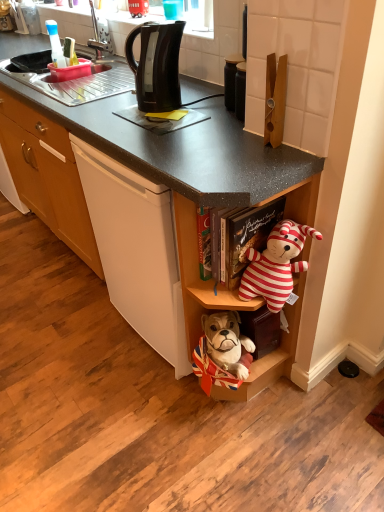
Locate an element on the screen. Image resolution: width=384 pixels, height=512 pixels. vacant space in front of black plastic kettle at upper center is located at coordinates (162, 125).